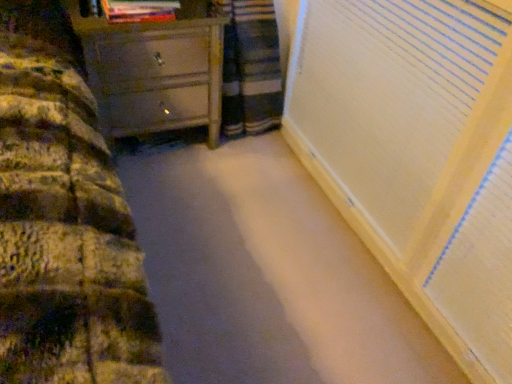
Identify the location of vacant area that lies to the right of matte gray chest of drawers at center. (249, 165).